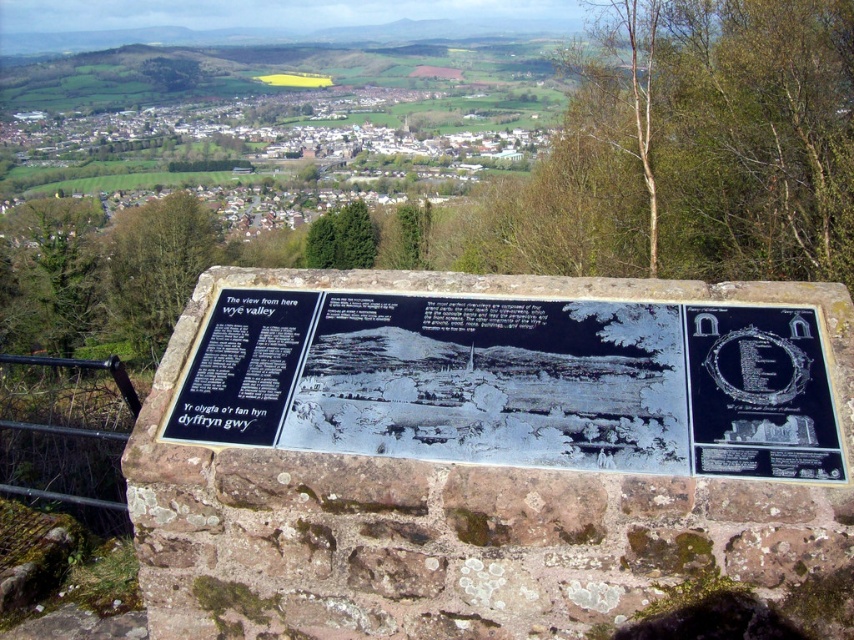
Does black stone sign at center appear over black stone plaque at upper right?

Indeed, black stone sign at center is positioned over black stone plaque at upper right.

Between black stone sign at center and black stone plaque at upper right, which one appears on the left side from the viewer's perspective?

black stone sign at center

The image size is (854, 640). I want to click on black stone sign at center, so click(x=516, y=381).